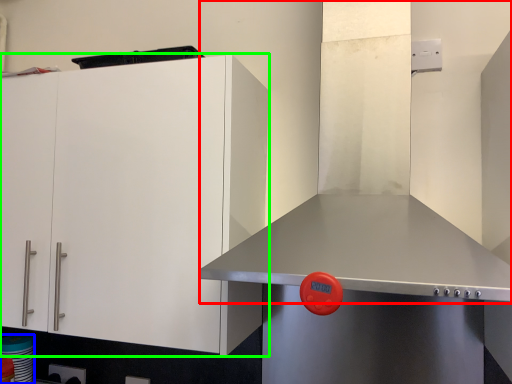
Question: Estimate the real-world distances between objects in this image. Which object is closer to exhaust hood (highlighted by a red box), appliance (highlighted by a blue box) or cabinetry (highlighted by a green box)?

Choices:
 (A) appliance
 (B) cabinetry

Answer: (B)